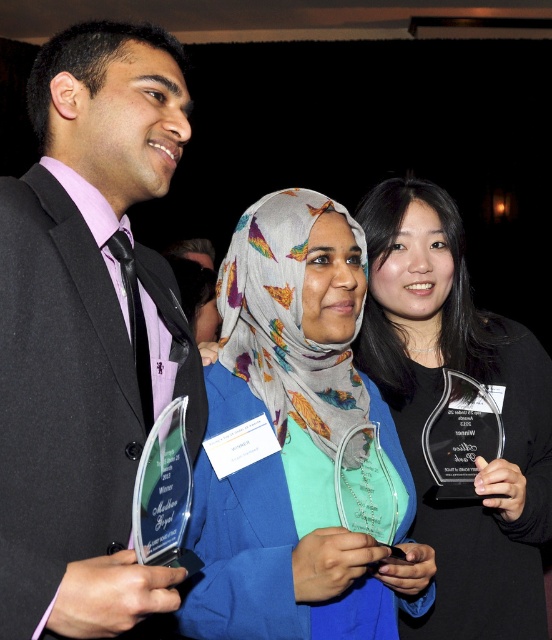
Question: Does translucent glass award at center have a lesser width compared to clear glass award at center?

Choices:
 (A) yes
 (B) no

Answer: (A)

Question: Which object appears farthest from the camera in this image?

Choices:
 (A) clear glass award at center
 (B) translucent glass award at center
 (C) matte black suit at left

Answer: (A)

Question: Does matte black suit at left appear under translucent glass award at center?

Choices:
 (A) no
 (B) yes

Answer: (A)

Question: Based on their relative distances, which object is farther from the translucent glass award at center?

Choices:
 (A) matte black suit at left
 (B) clear glass award at center

Answer: (B)

Question: Which object is the closest to the translucent glass award at center?

Choices:
 (A) matte black suit at left
 (B) clear glass award at center

Answer: (A)

Question: Is matte black suit at left wider than translucent glass award at center?

Choices:
 (A) no
 (B) yes

Answer: (A)